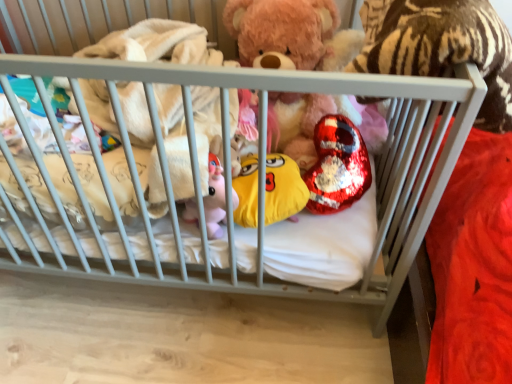
Question: Should I look upward or downward to see fluffy pink teddy bear at center?

Choices:
 (A) up
 (B) down

Answer: (A)

Question: Does fluffy pink teddy bear at center have a greater width compared to yellow plush toy at center, which is counted as the 2th toy, starting from the right?

Choices:
 (A) yes
 (B) no

Answer: (A)

Question: Is fluffy pink teddy bear at center placed right next to yellow plush toy at center, the first toy when ordered from left to right?

Choices:
 (A) yes
 (B) no

Answer: (B)

Question: Is fluffy pink teddy bear at center outside yellow plush toy at center, which is counted as the 2th toy, starting from the right?

Choices:
 (A) no
 (B) yes

Answer: (B)

Question: Considering the relative sizes of fluffy pink teddy bear at center and yellow plush toy at center, which is counted as the 2th toy, starting from the right, in the image provided, is fluffy pink teddy bear at center taller than yellow plush toy at center, which is counted as the 2th toy, starting from the right,?

Choices:
 (A) yes
 (B) no

Answer: (A)

Question: Can you confirm if fluffy pink teddy bear at center is thinner than yellow plush toy at center, the first toy when ordered from left to right?

Choices:
 (A) no
 (B) yes

Answer: (A)

Question: Is fluffy pink teddy bear at center closer to camera compared to yellow plush toy at center, which is counted as the 2th toy, starting from the right?

Choices:
 (A) yes
 (B) no

Answer: (B)

Question: Considering the relative sizes of yellow plush toy at center, the first toy when ordered from left to right, and fluffy pink teddy bear at center in the image provided, is yellow plush toy at center, the first toy when ordered from left to right, smaller than fluffy pink teddy bear at center?

Choices:
 (A) yes
 (B) no

Answer: (A)

Question: Is yellow plush toy at center, the first toy when ordered from left to right, directly adjacent to fluffy pink teddy bear at center?

Choices:
 (A) no
 (B) yes

Answer: (A)

Question: Considering the relative sizes of yellow plush toy at center, which is counted as the 2th toy, starting from the right, and fluffy pink teddy bear at center in the image provided, is yellow plush toy at center, which is counted as the 2th toy, starting from the right, bigger than fluffy pink teddy bear at center?

Choices:
 (A) yes
 (B) no

Answer: (B)

Question: Does yellow plush toy at center, the first toy when ordered from left to right, turn towards fluffy pink teddy bear at center?

Choices:
 (A) no
 (B) yes

Answer: (A)

Question: From a real-world perspective, is yellow plush toy at center, the first toy when ordered from left to right, beneath fluffy pink teddy bear at center?

Choices:
 (A) yes
 (B) no

Answer: (A)

Question: Considering the relative positions of yellow plush toy at center, the first toy when ordered from left to right, and fluffy pink teddy bear at center in the image provided, is yellow plush toy at center, the first toy when ordered from left to right, to the right of fluffy pink teddy bear at center from the viewer's perspective?

Choices:
 (A) yes
 (B) no

Answer: (B)

Question: From a real-world perspective, is shiny sequined heart at center, which is the 1th toy in right-to-left order, positioned under yellow plush toy at center, which is counted as the 2th toy, starting from the right, based on gravity?

Choices:
 (A) yes
 (B) no

Answer: (B)